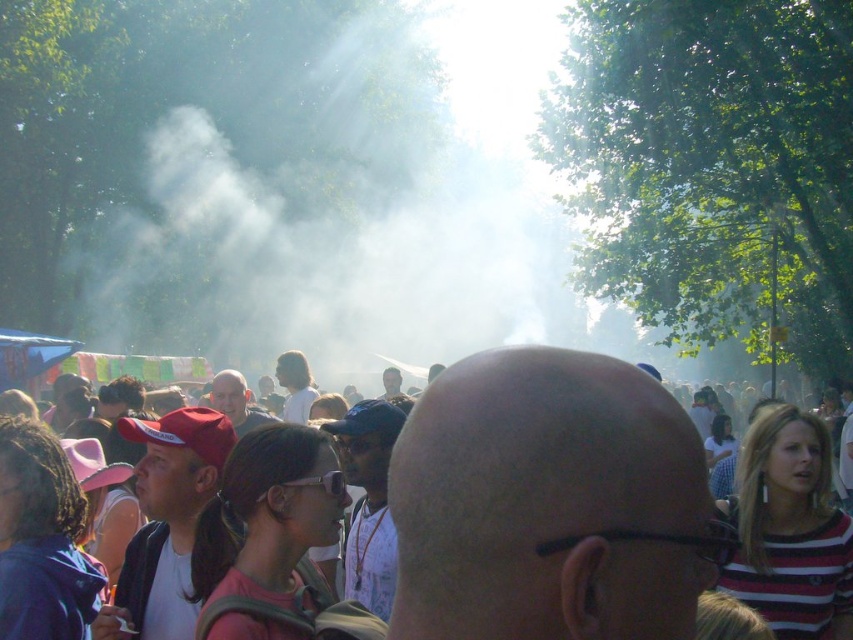
Question: Does bald head at center have a larger size compared to matte black shirt at center?

Choices:
 (A) yes
 (B) no

Answer: (B)

Question: Is bald head at center closer to the viewer compared to matte red cap at center-left?

Choices:
 (A) yes
 (B) no

Answer: (A)

Question: Which point is farther to the camera?

Choices:
 (A) matte red cap at center-left
 (B) white vapor at upper center

Answer: (B)

Question: Is white vapor at upper center thinner than white matte shirt at center?

Choices:
 (A) yes
 (B) no

Answer: (B)

Question: Which object is farther from the camera taking this photo?

Choices:
 (A) white matte shirt at center
 (B) matte red cap at center

Answer: (A)

Question: Which of these objects is positioned farthest from the matte red cap at center?

Choices:
 (A) white vapor at upper center
 (B) white matte shirt at center
 (C) matte red cap at center-left

Answer: (A)